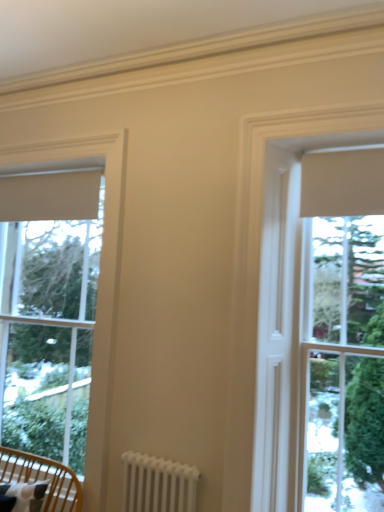
Question: Is white matte window at left shorter than white matte window at center?

Choices:
 (A) no
 (B) yes

Answer: (A)

Question: From the image's perspective, is white matte window at left beneath white matte window at center?

Choices:
 (A) no
 (B) yes

Answer: (B)

Question: Is the depth of white matte window at left less than that of white matte window at center?

Choices:
 (A) yes
 (B) no

Answer: (B)

Question: Does white matte window at left contain white matte window at center?

Choices:
 (A) yes
 (B) no

Answer: (B)

Question: Considering the relative sizes of white matte window at left and white matte window at center in the image provided, is white matte window at left smaller than white matte window at center?

Choices:
 (A) yes
 (B) no

Answer: (B)

Question: Based on their positions, is wooden chair with cushion at lower left located to the left or right of white matte window at center?

Choices:
 (A) left
 (B) right

Answer: (A)

Question: Relative to white matte window at center, is wooden chair with cushion at lower left in front or behind?

Choices:
 (A) behind
 (B) front

Answer: (A)

Question: In terms of width, does wooden chair with cushion at lower left look wider or thinner when compared to white matte window at center?

Choices:
 (A) wide
 (B) thin

Answer: (A)

Question: Is wooden chair with cushion at lower left taller or shorter than white matte window at center?

Choices:
 (A) short
 (B) tall

Answer: (A)

Question: From the image's perspective, is white matte window at center positioned above or below white metal radiator at lower center?

Choices:
 (A) below
 (B) above

Answer: (B)

Question: Does point (279, 181) appear closer or farther from the camera than point (148, 489)?

Choices:
 (A) closer
 (B) farther

Answer: (B)

Question: Do you think white matte window at center is within white metal radiator at lower center, or outside of it?

Choices:
 (A) outside
 (B) inside

Answer: (A)

Question: Looking at their shapes, would you say white matte window at center is wider or thinner than white metal radiator at lower center?

Choices:
 (A) thin
 (B) wide

Answer: (A)

Question: From a real-world perspective, is white metal radiator at lower center above or below white matte window at center?

Choices:
 (A) above
 (B) below

Answer: (B)

Question: Looking at their shapes, would you say white metal radiator at lower center is wider or thinner than white matte window at center?

Choices:
 (A) wide
 (B) thin

Answer: (A)